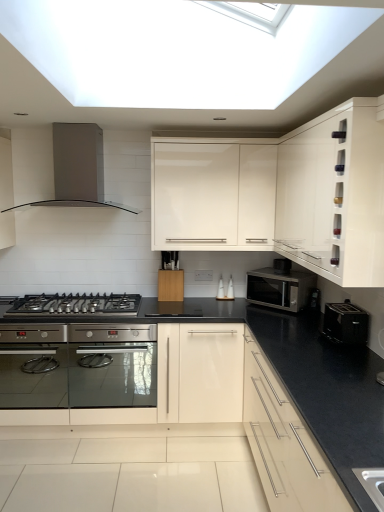
I want to click on free spot above satin silver range hood at upper left (from a real-world perspective), so click(74, 120).